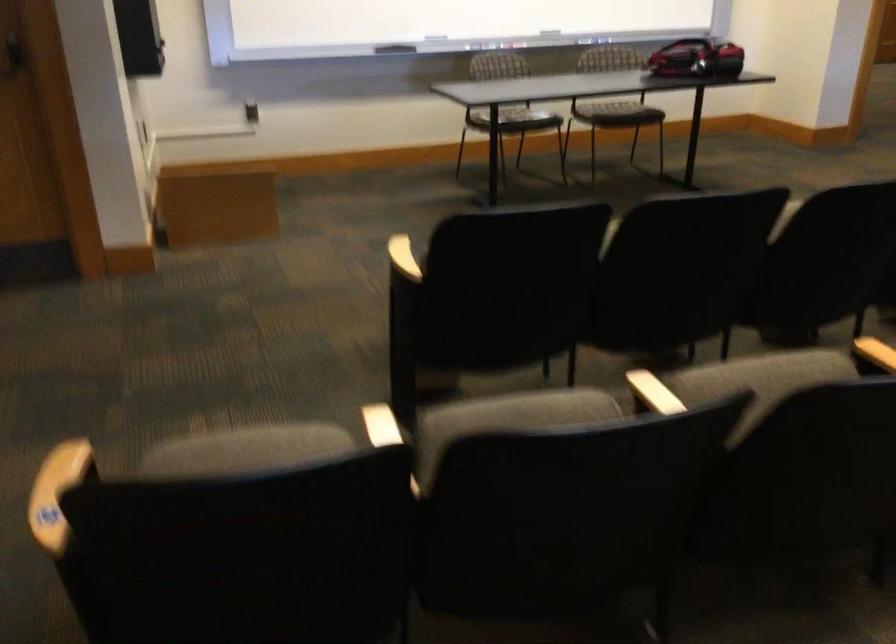
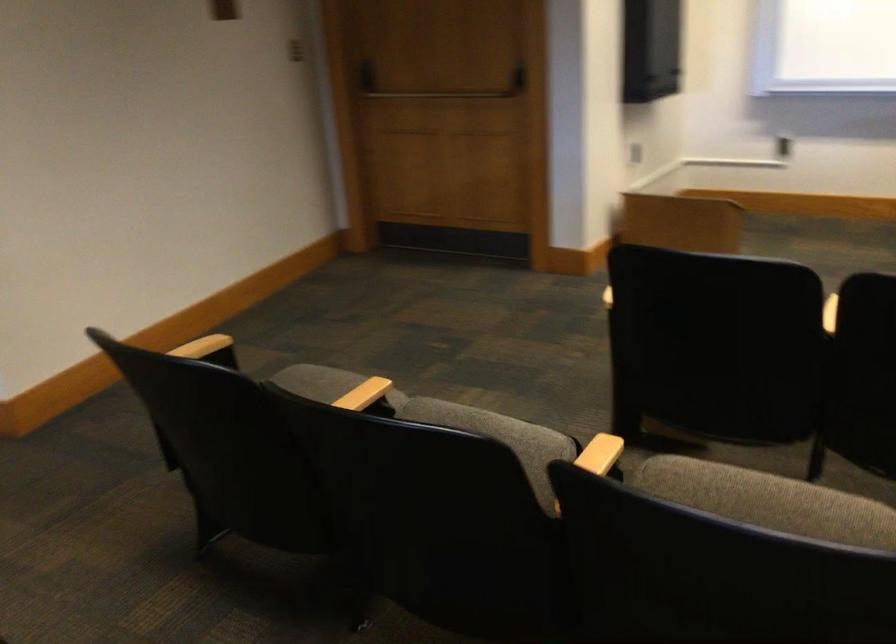
In the second image, find the point that corresponds to pixel 529 404 in the first image.

(490, 426)